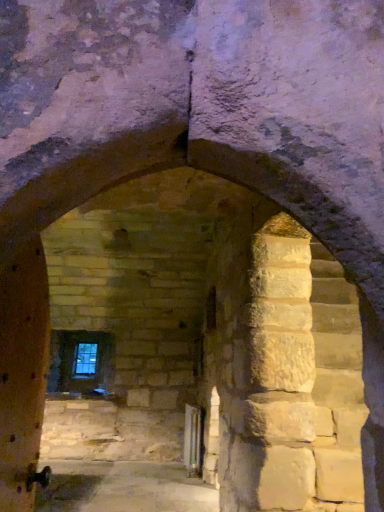
This screenshot has height=512, width=384. What do you see at coordinates (85, 359) in the screenshot?
I see `clear glass window at center` at bounding box center [85, 359].

The image size is (384, 512). I want to click on clear glass window at center, so click(x=85, y=359).

I want to click on clear glass window at center, so click(x=85, y=359).